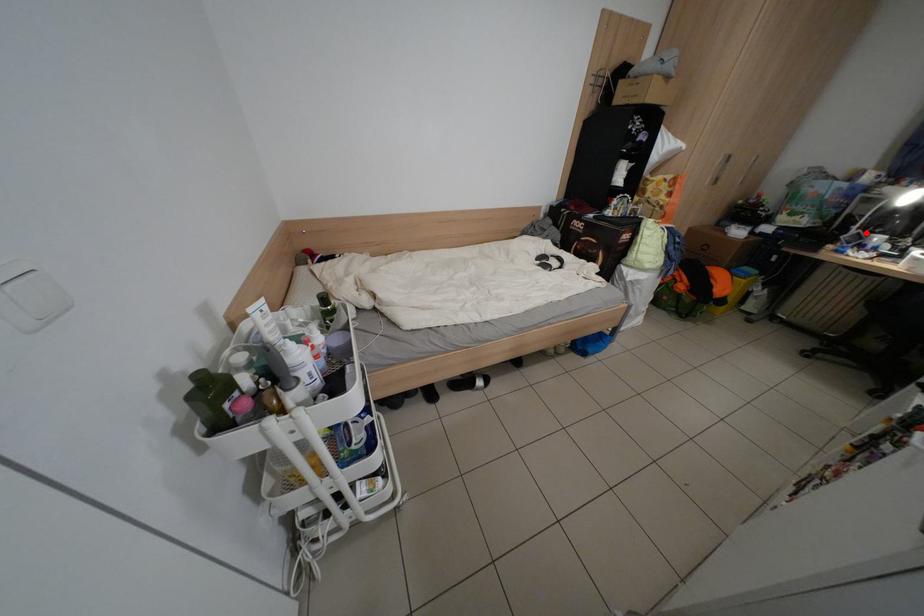
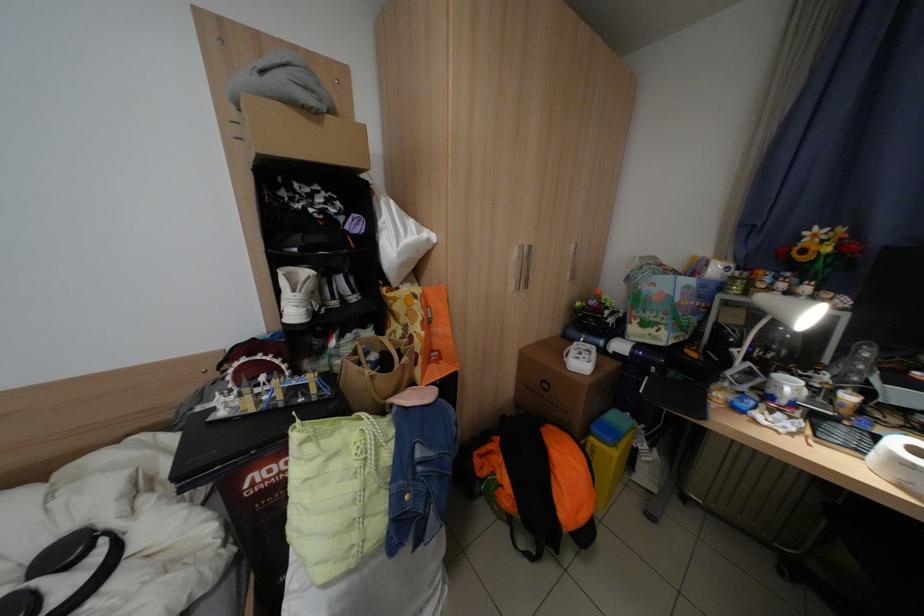
In the second image, find the point that corresponds to the highlighted location in the first image.

(752, 366)